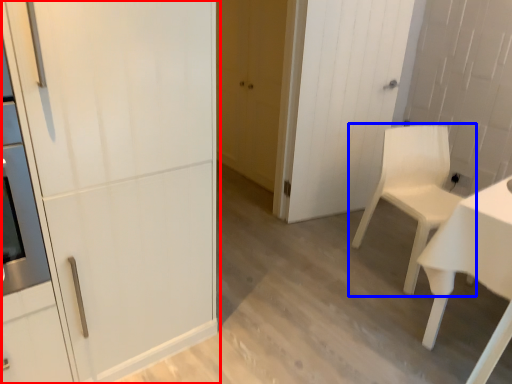
Question: Among these objects, which one is farthest to the camera, door (highlighted by a red box) or chair (highlighted by a blue box)?

Choices:
 (A) door
 (B) chair

Answer: (B)